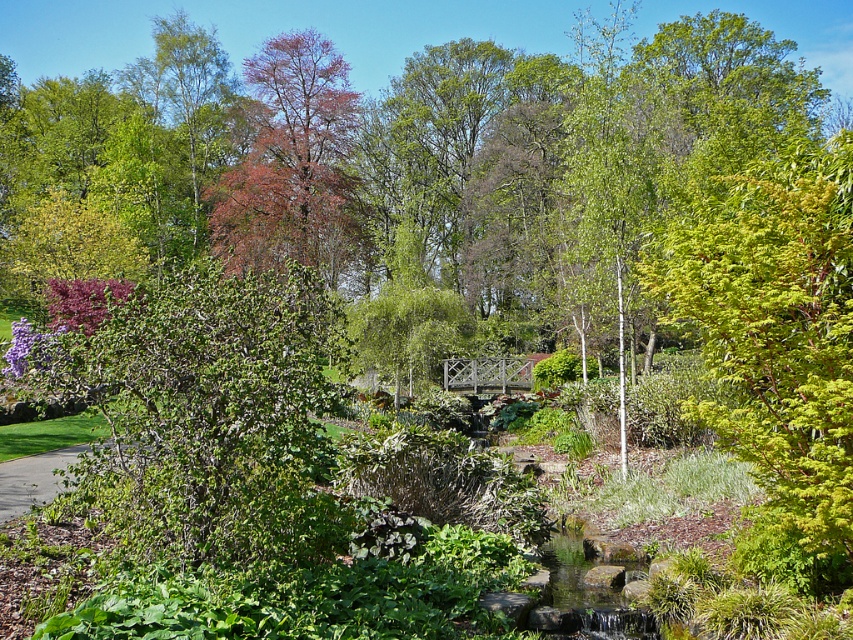
Can you confirm if green leafy bush at center is positioned above green grass at lower left?

Correct, green leafy bush at center is located above green grass at lower left.

Between point (311, 432) and point (20, 497), which one is positioned in front?

Point (311, 432)

Find the location of `green leafy bush at center`. green leafy bush at center is located at coordinates (209, 417).